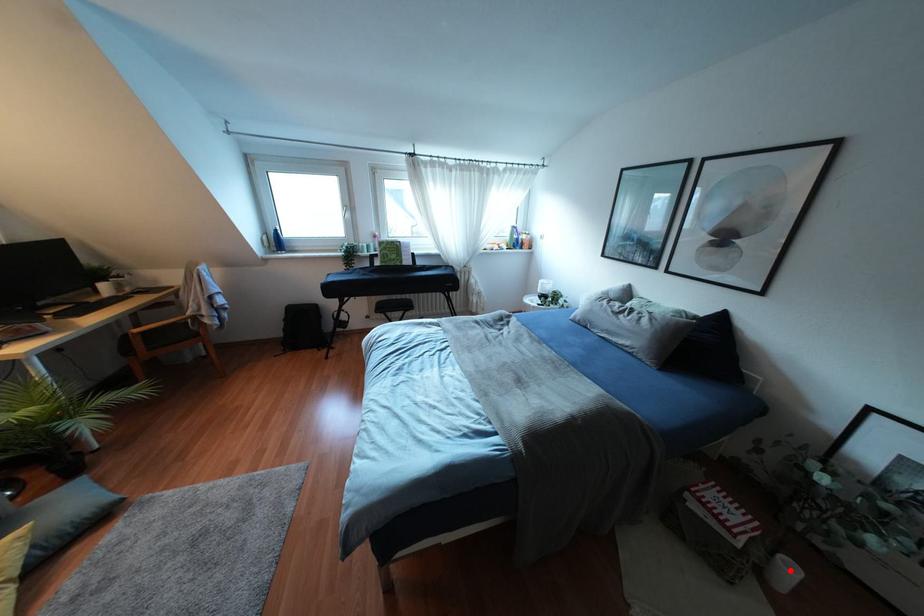
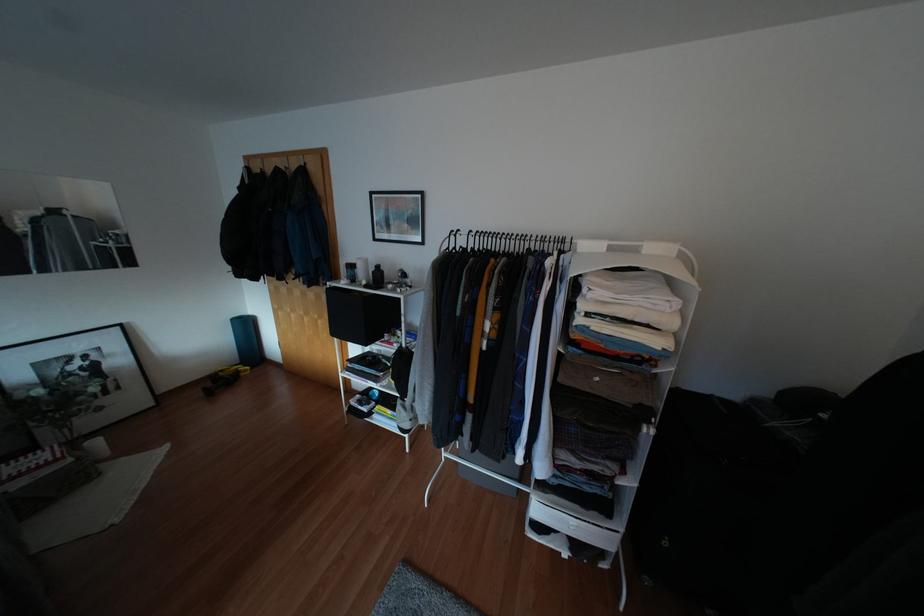
Find the pixel in the second image that matches the highlighted location in the first image.

(94, 442)